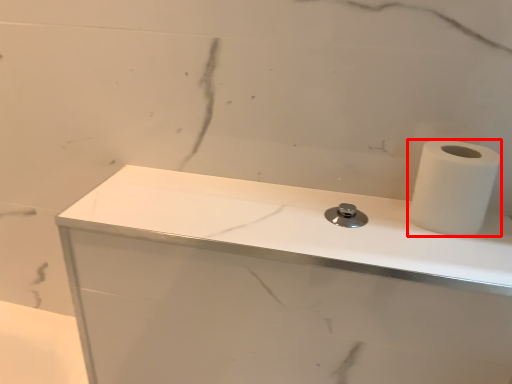
Question: From the image's perspective, where is paper towel (annotated by the red box) located in relation to counter top in the image?

Choices:
 (A) below
 (B) above

Answer: (B)